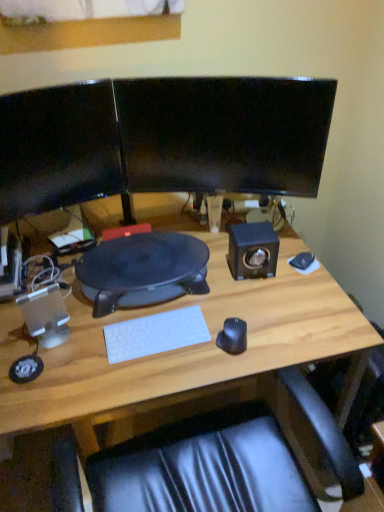
Question: From a real-world perspective, is wooden desk at center positioned over white plastic speaker at left, the second speaker viewed from the right, based on gravity?

Choices:
 (A) no
 (B) yes

Answer: (A)

Question: Is wooden desk at center behind white plastic speaker at left, the first speaker in the left-to-right sequence?

Choices:
 (A) no
 (B) yes

Answer: (A)

Question: Can you confirm if wooden desk at center is positioned to the left of white plastic speaker at left, which is counted as the first speaker, starting from the bottom?

Choices:
 (A) no
 (B) yes

Answer: (A)

Question: Is wooden desk at center positioned far away from white plastic speaker at left, arranged as the 1th speaker when viewed from the front?

Choices:
 (A) yes
 (B) no

Answer: (B)

Question: Is wooden desk at center at the right side of white plastic speaker at left, which is counted as the first speaker, starting from the bottom?

Choices:
 (A) no
 (B) yes

Answer: (B)

Question: In terms of size, does wooden desk at center appear bigger or smaller than white plastic speaker at left, placed as the second speaker when sorted from back to front?

Choices:
 (A) big
 (B) small

Answer: (A)

Question: Does point (82, 451) appear closer or farther from the camera than point (41, 293)?

Choices:
 (A) farther
 (B) closer

Answer: (A)

Question: Considering the positions of wooden desk at center and white plastic speaker at left, arranged as the 1th speaker when viewed from the front, in the image, is wooden desk at center taller or shorter than white plastic speaker at left, arranged as the 1th speaker when viewed from the front,?

Choices:
 (A) short
 (B) tall

Answer: (B)

Question: In the image, is wooden desk at center positioned in front of or behind white plastic speaker at left, the second speaker viewed from the right?

Choices:
 (A) behind
 (B) front

Answer: (B)

Question: Is black rubberized desk at center bigger or smaller than matte black monitor at left, which is the second computer monitor from right to left?

Choices:
 (A) small
 (B) big

Answer: (B)

Question: Is black rubberized desk at center inside the boundaries of matte black monitor at left, acting as the 1th computer monitor starting from the left, or outside?

Choices:
 (A) inside
 (B) outside

Answer: (B)

Question: From a real-world perspective, relative to matte black monitor at left, acting as the 1th computer monitor starting from the left, is black rubberized desk at center vertically above or below?

Choices:
 (A) below
 (B) above

Answer: (A)

Question: Is point (97, 249) positioned closer to the camera than point (66, 110)?

Choices:
 (A) farther
 (B) closer

Answer: (A)

Question: Considering the positions of white plastic speaker at left, placed as the second speaker when sorted from back to front, and matte black monitor at left, which is the second computer monitor from right to left, in the image, is white plastic speaker at left, placed as the second speaker when sorted from back to front, bigger or smaller than matte black monitor at left, which is the second computer monitor from right to left,?

Choices:
 (A) big
 (B) small

Answer: (B)

Question: Is white plastic speaker at left, placed as the 2th speaker when sorted from top to bottom, wider or thinner than matte black monitor at left, which is the second computer monitor from right to left?

Choices:
 (A) thin
 (B) wide

Answer: (B)